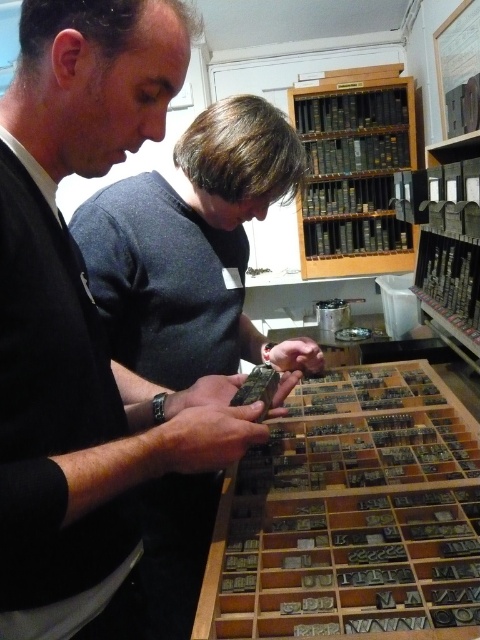
Question: Is black matte phone at center wider than metallic letterpress blocks at center?

Choices:
 (A) no
 (B) yes

Answer: (A)

Question: Which point is closer to the camera?

Choices:
 (A) (356, 92)
 (B) (58, 588)

Answer: (B)

Question: Is black matte phone at center behind metallic letterpress blocks at center?

Choices:
 (A) yes
 (B) no

Answer: (B)

Question: Among these points, which one is farthest from the camera?

Choices:
 (A) (314, 243)
 (B) (368, 576)

Answer: (A)

Question: Among these objects, which one is nearest to the camera?

Choices:
 (A) metallic letterpress blocks at center
 (B) wooden bookshelf at upper center

Answer: (A)

Question: Does metallic letterpress blocks at center appear under wooden bookshelf at upper center?

Choices:
 (A) no
 (B) yes

Answer: (B)